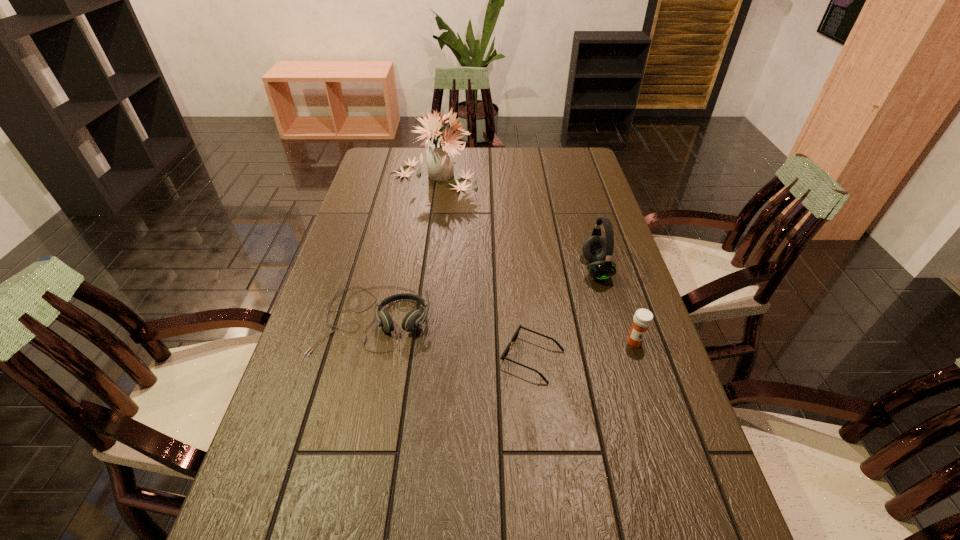
Where is `the farthest object`? the farthest object is located at coordinates (439, 149).

Locate an element on the screen. This screenshot has width=960, height=540. bouquet is located at coordinates (439, 149).

Where is `the right headset`? This screenshot has height=540, width=960. the right headset is located at coordinates (596, 248).

At what (x,y) coordinates should I click in order to perform the action: click on the taller headset. Please return your answer as a coordinate pair (x, y). Looking at the image, I should click on (596, 248).

This screenshot has height=540, width=960. What are the coordinates of `medicine` in the screenshot? It's located at (642, 319).

This screenshot has width=960, height=540. Find the location of `the fourth tallest object`. the fourth tallest object is located at coordinates click(x=414, y=318).

Locate an element on the screen. the left headset is located at coordinates (414, 318).

This screenshot has width=960, height=540. I want to click on the shortest object, so click(515, 336).

At what (x,y) coordinates should I click in order to perform the action: click on sunglasses. Please return your answer as a coordinate pair (x, y). Image resolution: width=960 pixels, height=540 pixels. Looking at the image, I should click on (515, 336).

Where is `vacant space located 0.280m on the right of the bouquet`? The width and height of the screenshot is (960, 540). vacant space located 0.280m on the right of the bouquet is located at coordinates (551, 177).